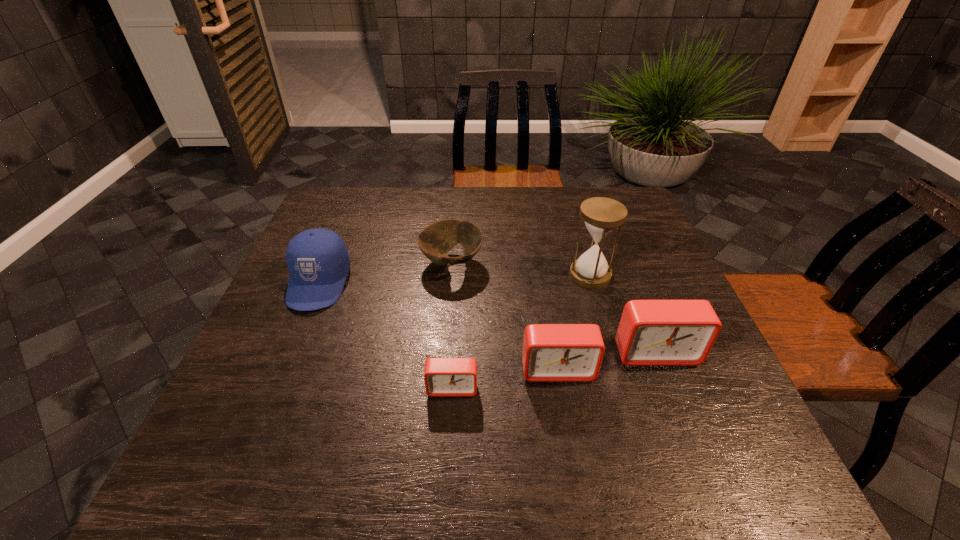
Image resolution: width=960 pixels, height=540 pixels. Identify the location of free space located on the back of the hourglass. (571, 208).

Locate an element on the screen. object that is at the near edge is located at coordinates (443, 376).

This screenshot has height=540, width=960. What are the coordinates of `object at the left edge` in the screenshot? It's located at (318, 261).

This screenshot has height=540, width=960. I want to click on object at the right edge, so point(651,332).

At what (x,y) coordinates should I click in order to perform the action: click on free space at the far edge. Please return your answer as a coordinate pair (x, y). The width and height of the screenshot is (960, 540). Looking at the image, I should click on (407, 201).

This screenshot has height=540, width=960. Identify the location of free space at the near edge of the desktop. (626, 417).

What are the coordinates of `free space at the left edge of the desktop` in the screenshot? It's located at (283, 364).

Where is `vacant region at the right edge of the desktop`? The height and width of the screenshot is (540, 960). vacant region at the right edge of the desktop is located at coordinates (696, 388).

Where is `free space at the near left corner of the desktop`? This screenshot has width=960, height=540. free space at the near left corner of the desktop is located at coordinates (275, 428).

In the image, there is a desktop. At what (x,y) coordinates should I click in order to perform the action: click on vacant space at the far right corner. Please return your answer as a coordinate pair (x, y). This screenshot has width=960, height=540. Looking at the image, I should click on (588, 199).